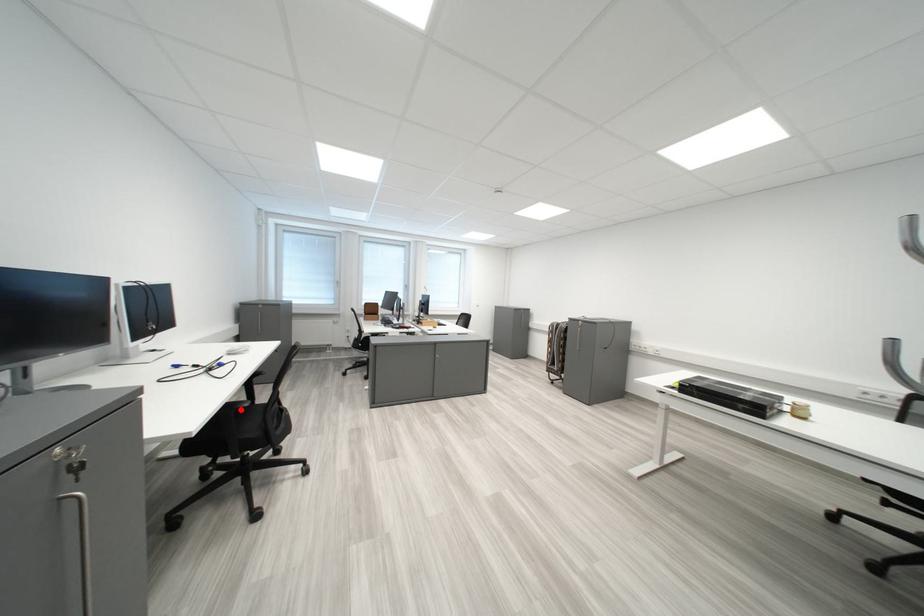
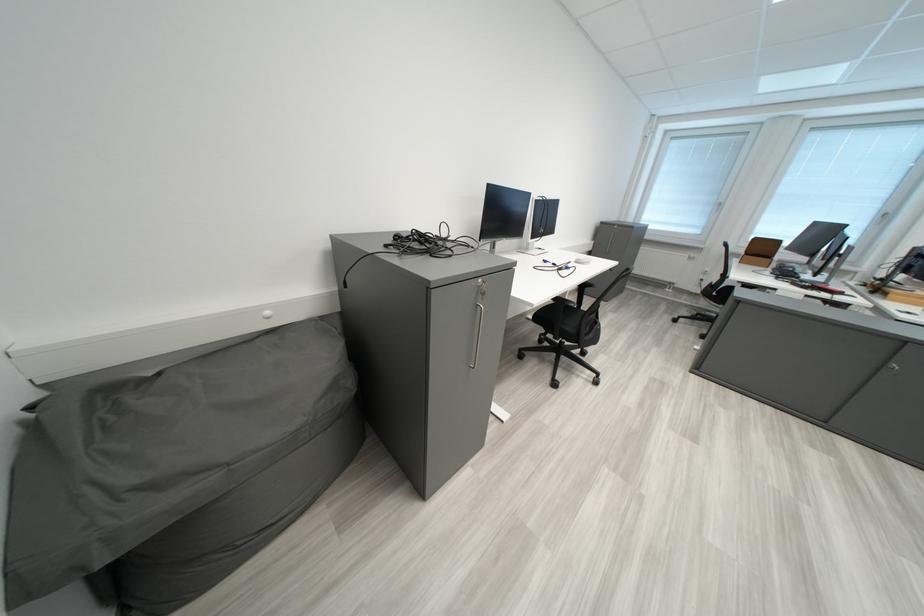
Find the pixel in the second image that matches the highlighted location in the first image.

(573, 302)